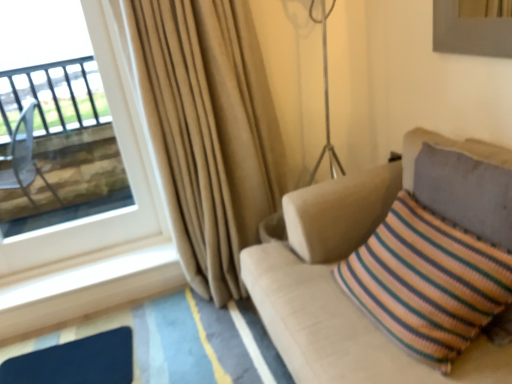
Locate an element on the screen. This screenshot has width=512, height=384. free space behind matte blue mat at lower left is located at coordinates (90, 332).